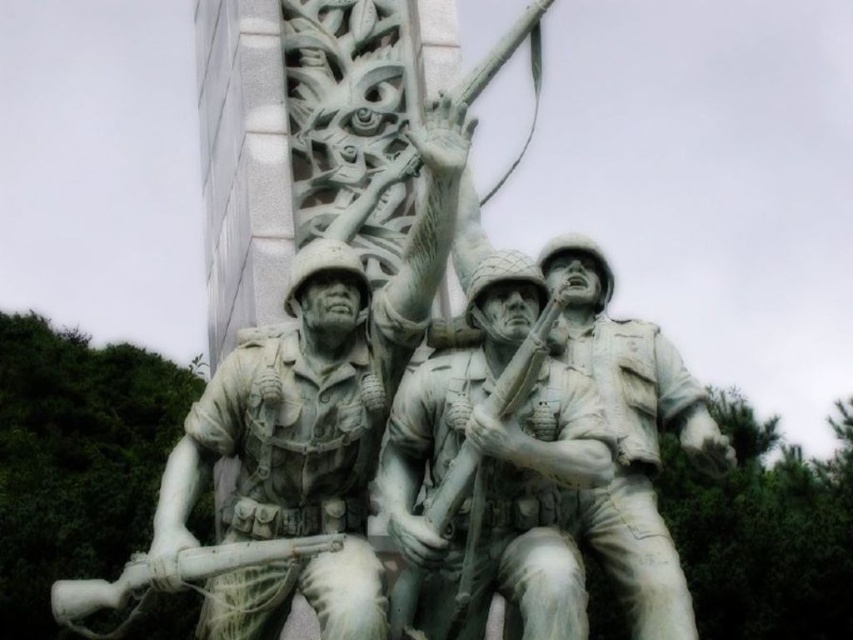
You are a tour guide explaining the sculpture to visitors. You want to mention the distance between the gray stone soldier at center and the white matte rifle at lower left. How far apart are they?

The gray stone soldier at center is 26.16 feet away from the white matte rifle at lower left.

Consider the image. You are a photographer standing at the base of the monument. You want to capture a photo of the white marble statue at center. If your camera has a maximum focus range of 35 meters, will you be able to focus on the statue?

The white marble statue at center is 37.70 meters away from the camera. Since the maximum focus range is 35 meters, the camera cannot focus on the statue.

You are an art curator planning to display both the white marble statue at center and the gray stone soldier at center in a gallery. Given their sizes, which one should be placed in a larger exhibition space to accommodate its dimensions?

The white marble statue at center has a larger size compared to the gray stone soldier at center, so it should be placed in a larger exhibition space to accommodate its dimensions.